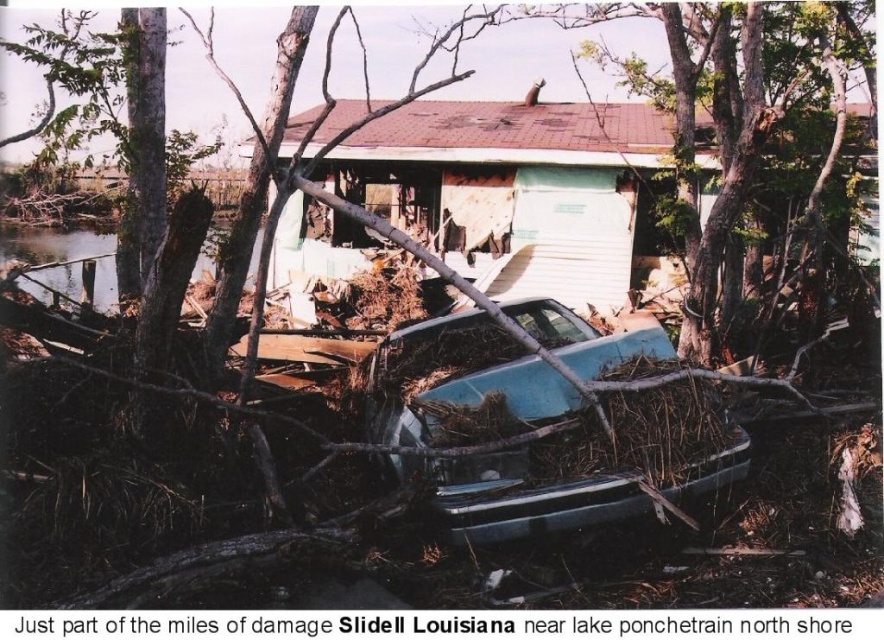
Question: Is white painted wood house at center wider than teal matte car at center?

Choices:
 (A) yes
 (B) no

Answer: (B)

Question: Is white painted wood house at center wider than teal matte car at center?

Choices:
 (A) no
 (B) yes

Answer: (A)

Question: Among these objects, which one is nearest to the camera?

Choices:
 (A) white painted wood house at center
 (B) teal matte car at center

Answer: (B)

Question: Does white painted wood house at center lie in front of teal matte car at center?

Choices:
 (A) no
 (B) yes

Answer: (A)

Question: Which object is farther from the camera taking this photo?

Choices:
 (A) white painted wood house at center
 (B) teal matte car at center

Answer: (A)